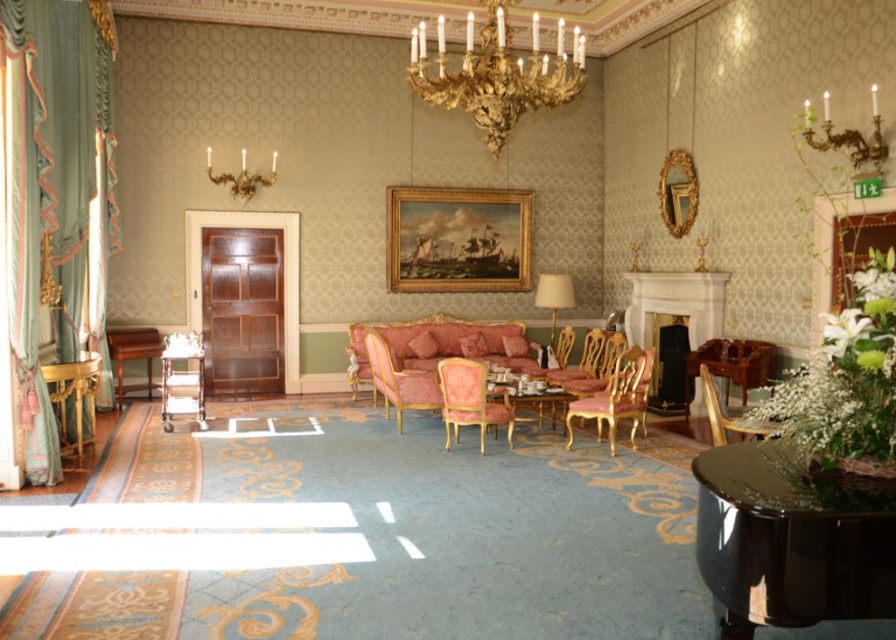
You are a maintenance worker who needs to inspect the gold metallic chandelier at upper center. You are currently standing next to the metallic gold armchair at lower left. If your ladder can reach up to 8 feet, will you be able to reach the chandelier?

The distance between the metallic gold armchair at lower left and the gold metallic chandelier at upper center is 8.66 feet. Since the ladder can only reach up to 8 feet, you will not be able to reach the chandelier with the current ladder.